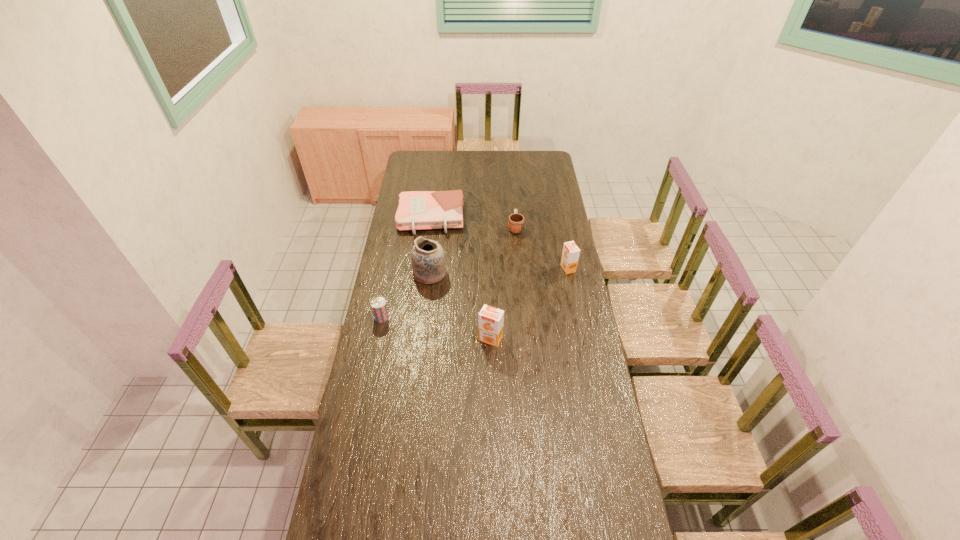
Please point a spot on the left to add another orange juice. Please provide its 2D coordinates. Your answer should be formatted as a tuple, i.e. [(x, y)], where the tuple contains the x and y coordinates of a point satisfying the conditions above.

[(385, 435)]